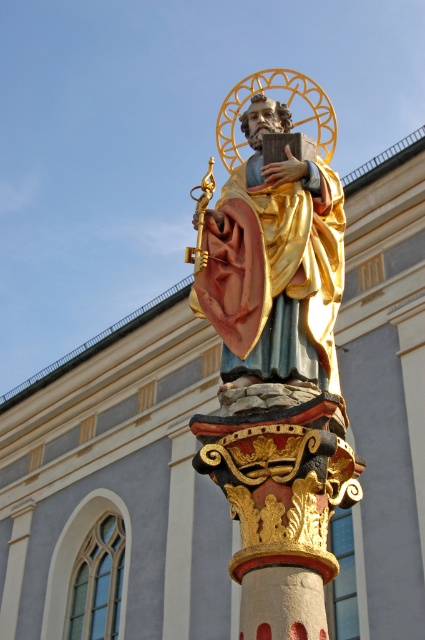
You are standing in front of the statue of Saint Peter. There are two points marked on the column supporting the statue. One is at coordinate point (266, 499) and the other is at point (278, 272). From your perspective, which point is closer to you?

Point (266, 499) is in front of point (278, 272), so it is closer to you.

Based on the scene description, where is the gold plated statue at center located in terms of its 2D coordinates?

The gold plated statue at center is located at coordinates point (275, 250).